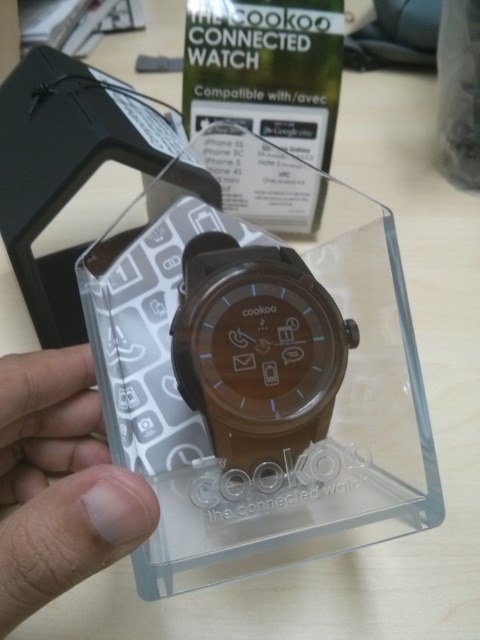
Who is positioned more to the left, brown matte watch at center or skinny white finger at lower left?

Positioned to the left is skinny white finger at lower left.

Find the location of a particular element. The height and width of the screenshot is (640, 480). brown matte watch at center is located at coordinates (256, 349).